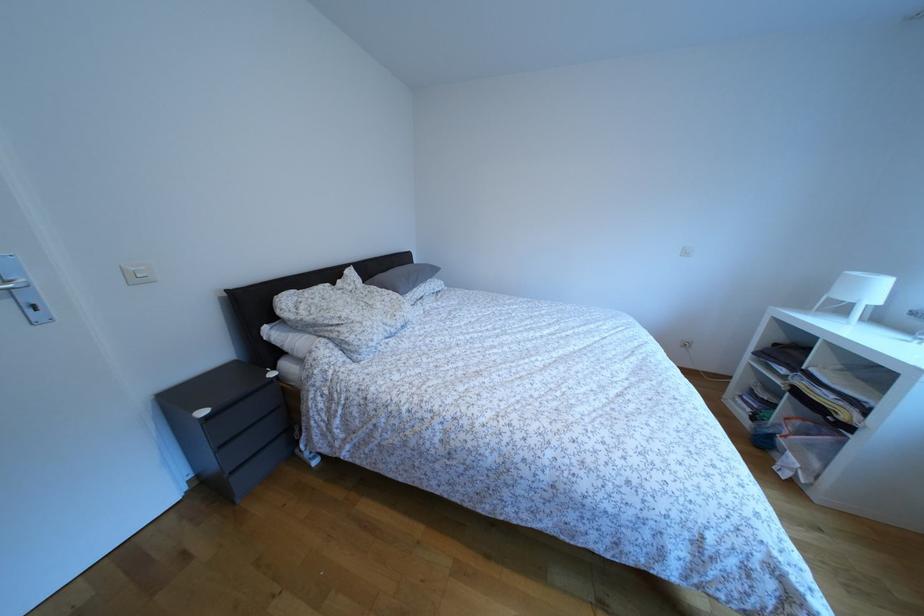
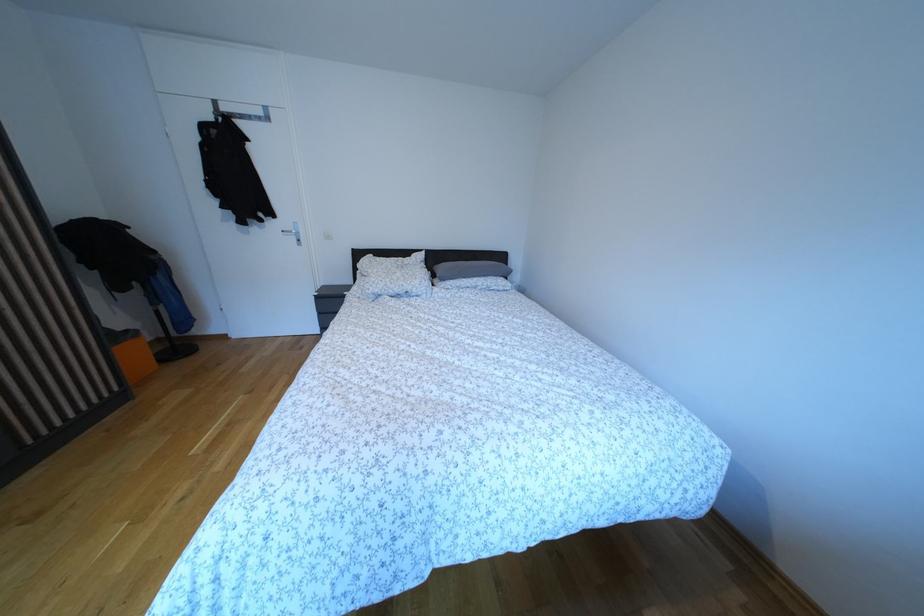
Locate, in the second image, the point that corresponds to (x=386, y=312) in the first image.

(406, 281)